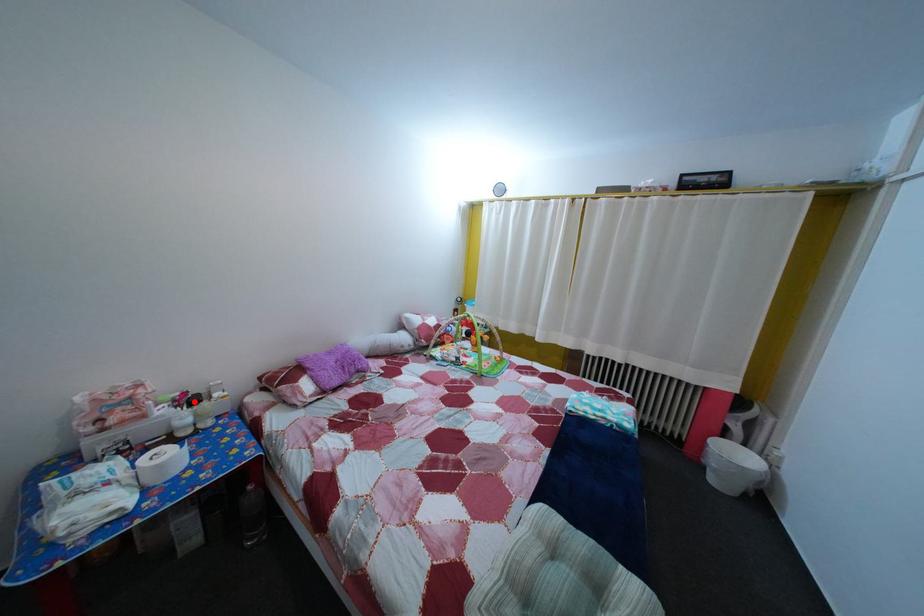
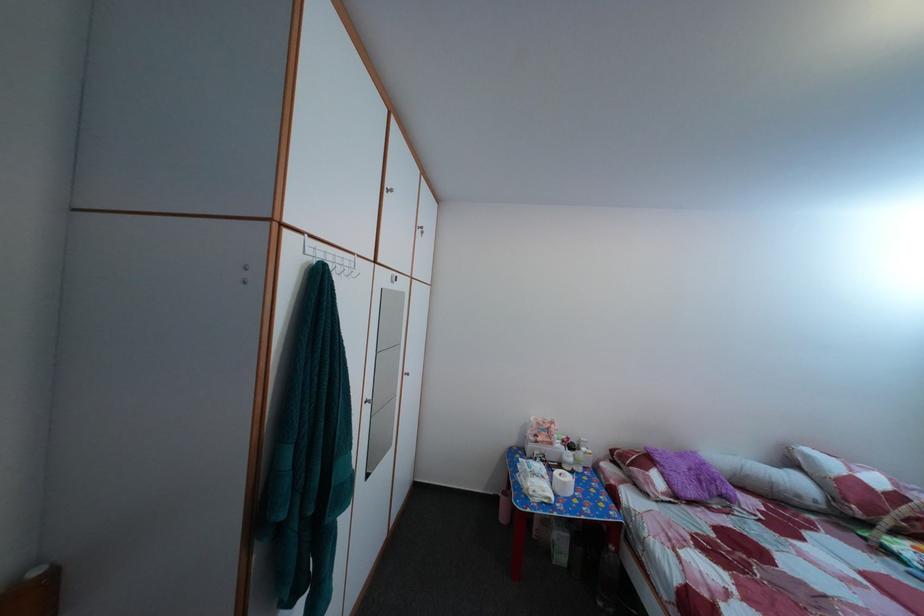
Question: I am providing you with two images of the same scene from different viewpoints. In image1, a red point is highlighted. Considering the same 3D point in image2, which of the following is correct?

Choices:
 (A) It is closer
 (B) It is farther

Answer: (B)